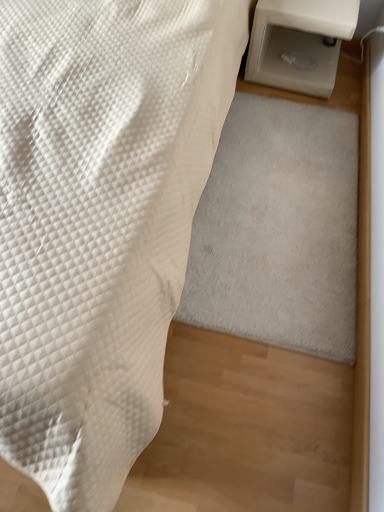
Question: In terms of width, does white quilted fabric at lower left look wider or thinner when compared to white plastic table at right?

Choices:
 (A) wide
 (B) thin

Answer: (A)

Question: From their relative heights in the image, would you say white quilted fabric at lower left is taller or shorter than white plastic table at right?

Choices:
 (A) short
 (B) tall

Answer: (B)

Question: Based on their relative distances, which object is farther from the white soft rug at lower right?

Choices:
 (A) white plastic table at right
 (B) white quilted fabric at lower left

Answer: (A)

Question: Which object is positioned farthest from the white soft rug at lower right?

Choices:
 (A) white plastic table at right
 (B) white quilted fabric at lower left

Answer: (A)